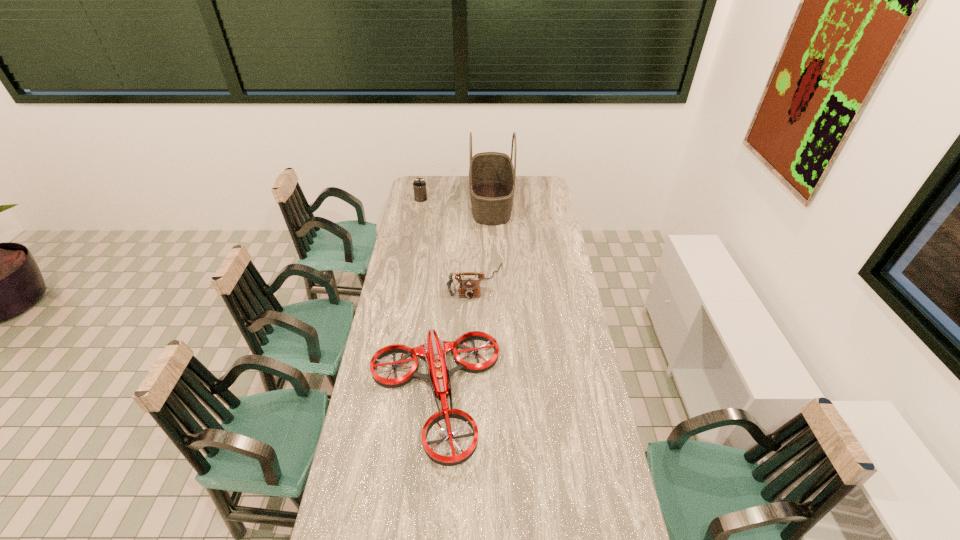
The image size is (960, 540). Identify the location of free spot between the second nearest object and the can. (448, 240).

Locate an element on the screen. unoccupied position between the tallest object and the can is located at coordinates (456, 200).

Identify the location of free space that is in between the third farthest object and the basket. The width and height of the screenshot is (960, 540). (484, 242).

The width and height of the screenshot is (960, 540). Find the location of `object that is the closest one to the drone`. object that is the closest one to the drone is located at coordinates (469, 288).

The height and width of the screenshot is (540, 960). Identify the location of the closest object relative to the can. (492, 175).

The width and height of the screenshot is (960, 540). In order to click on free space that satisfies the following two spatial constraints: 1. on the front side of the nearest object; 2. on the right side of the can in this screenshot , I will do `click(384, 397)`.

I want to click on vacant space that satisfies the following two spatial constraints: 1. on the front side of the drone; 2. on the left side of the can, so click(x=384, y=397).

You are a GUI agent. You are given a task and a screenshot of the screen. Output one action in this format:
    pyautogui.click(x=<x>, y=<y>)
    Task: Click on the free point that satisfies the following two spatial constraints: 1. on the front side of the nearest object; 2. on the right side of the can
    
    Given the screenshot: What is the action you would take?
    pyautogui.click(x=384, y=397)